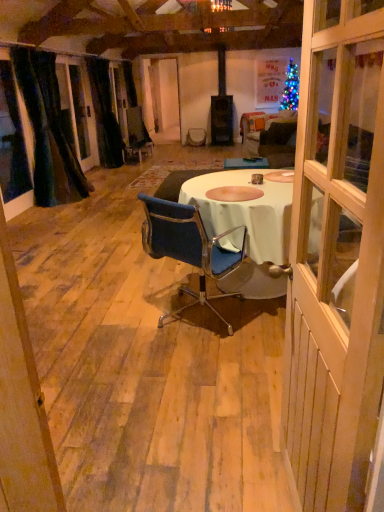
Question: From the image's perspective, is blue fabric chair at center positioned above or below velvety dark green curtain at left, arranged as the first curtain when viewed from the front?

Choices:
 (A) above
 (B) below

Answer: (B)

Question: Which is correct: blue fabric chair at center is inside velvety dark green curtain at left, arranged as the first curtain when viewed from the front, or outside of it?

Choices:
 (A) inside
 (B) outside

Answer: (B)

Question: Which object is the closest to the wooden door at center?

Choices:
 (A) black velvet curtain at left, the second curtain from the front
 (B) velvety dark green curtain at left, arranged as the first curtain when viewed from the front
 (C) blue fabric chair at center

Answer: (C)

Question: Estimate the real-world distances between objects in this image. Which object is farther from the velvety dark green curtain at left, arranged as the first curtain when viewed from the front?

Choices:
 (A) wooden door at center
 (B) black velvet curtain at left, the second curtain from the front
 (C) blue fabric chair at center

Answer: (A)